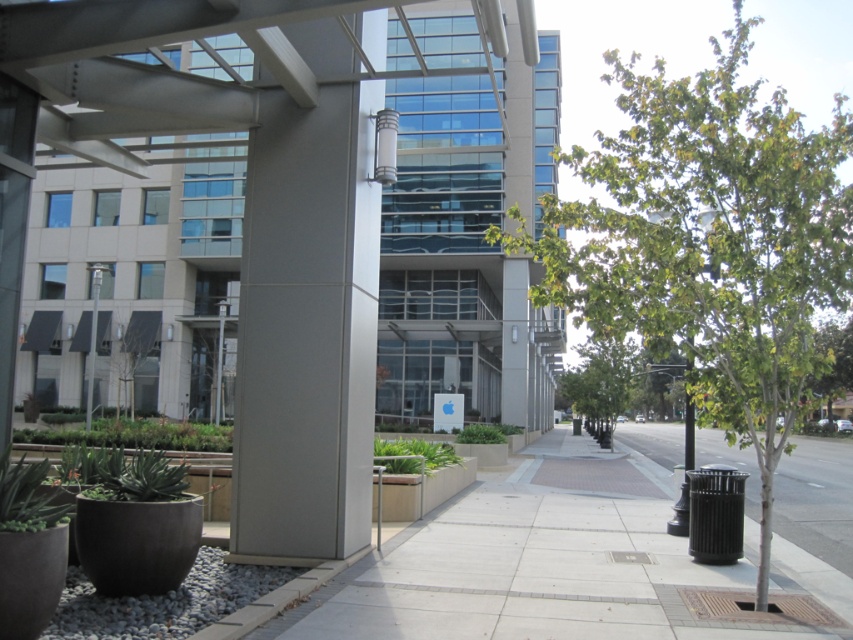
Question: Can you confirm if green matte planter at lower left is positioned above green matte planter at center?

Choices:
 (A) yes
 (B) no

Answer: (B)

Question: Which point is farther to the camera?

Choices:
 (A) [767, 248]
 (B) [416, 472]
 (C) [93, 428]

Answer: (C)

Question: Is green matte planter at lower left thinner than green matte planter at center?

Choices:
 (A) no
 (B) yes

Answer: (A)

Question: Which object is closer to the camera taking this photo?

Choices:
 (A) green leafy tree at center
 (B) green matte planter at center
 (C) green matte planter at lower left

Answer: (A)

Question: Is green leafy tree at center positioned in front of green matte planter at center?

Choices:
 (A) no
 (B) yes

Answer: (B)

Question: Which point appears closest to the camera in this image?

Choices:
 (A) (440, 465)
 (B) (757, 592)

Answer: (B)